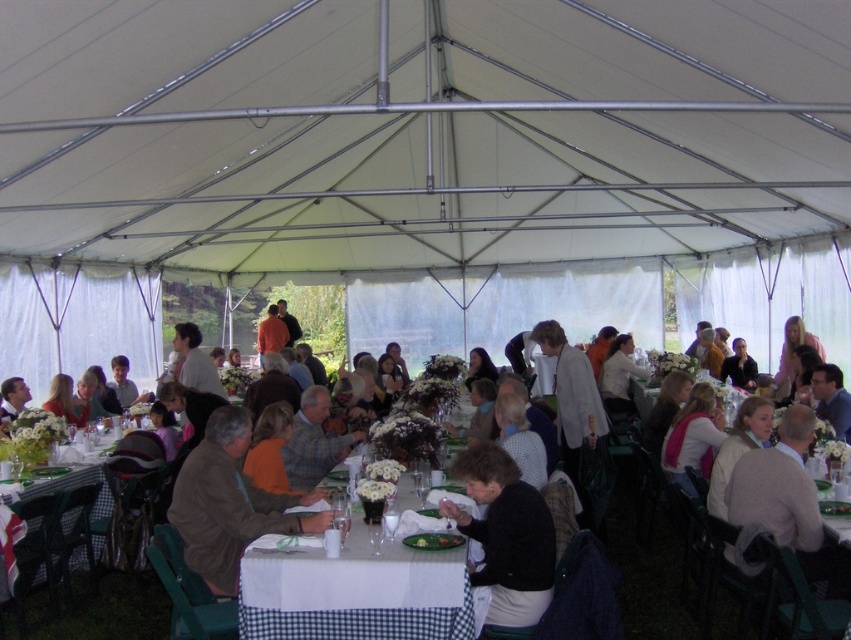
Is white checkered tablecloth at center further to camera compared to matte brown shirt at center?

No.

Find the location of a particular element. white checkered tablecloth at center is located at coordinates (355, 593).

Does point (732, 12) come in front of point (243, 548)?

No, it is behind (243, 548).

Is white fabric canopy at upper center to the right of brown leather jacket at center from the viewer's perspective?

Yes, white fabric canopy at upper center is to the right of brown leather jacket at center.

You are a GUI agent. You are given a task and a screenshot of the screen. Output one action in this format:
    pyautogui.click(x=<x>, y=<y>)
    Task: Click on the white fabric canopy at upper center
    The image size is (851, 640).
    Given the screenshot: What is the action you would take?
    pyautogui.click(x=418, y=129)

What are the coordinates of `white fabric canopy at upper center` in the screenshot? It's located at (418, 129).

Can you confirm if white fabric canopy at upper center is shorter than white checkered tablecloth at lower left?

No, white fabric canopy at upper center is not shorter than white checkered tablecloth at lower left.

Does white fabric canopy at upper center appear under white checkered tablecloth at lower left?

No.

Between point (694, 248) and point (44, 428), which one is positioned behind?

The point (694, 248) is behind.

I want to click on white fabric canopy at upper center, so click(418, 129).